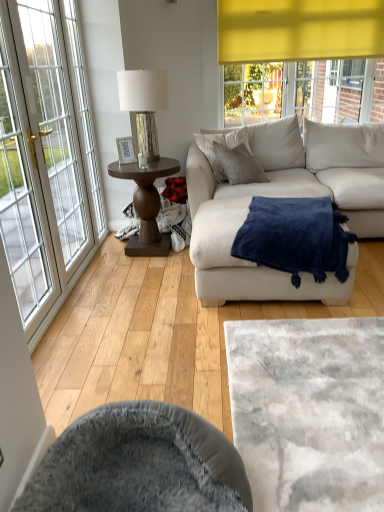
Find the location of a particular element. unoccupied space behind velvet grey swivel chair at lower center is located at coordinates (139, 372).